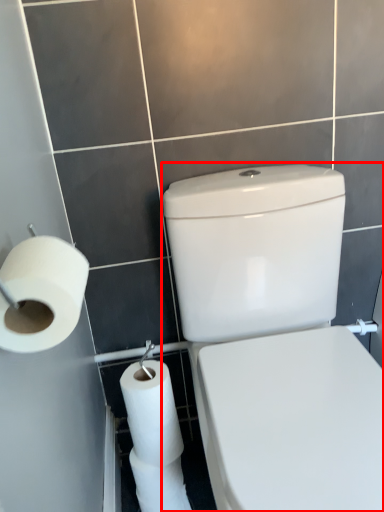
Question: Observing the image, what is the correct spatial positioning of porcelain (annotated by the red box) in reference to toilet paper?

Choices:
 (A) right
 (B) left

Answer: (A)